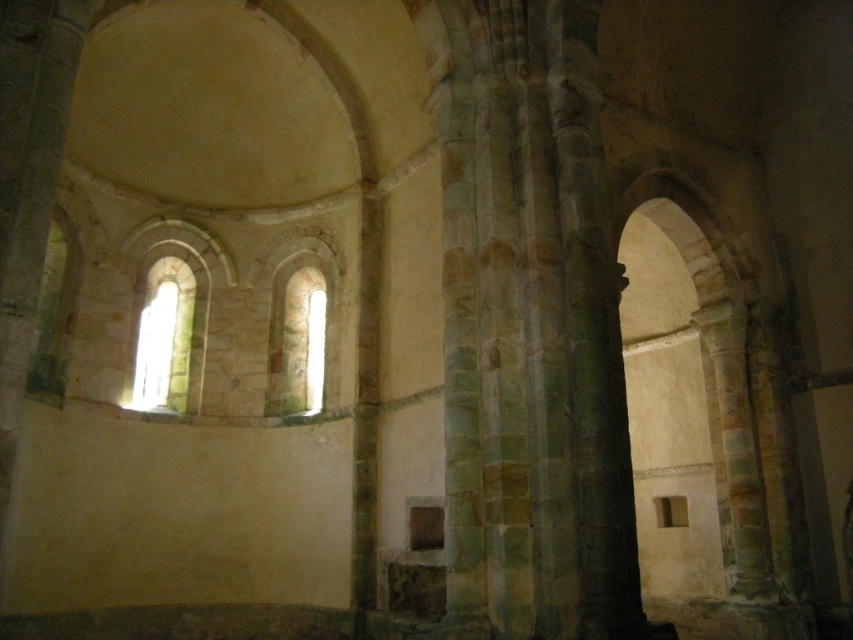
You are an architect examining the historical stone structure. You notice two windows in the left wall. One is a translucent stone window at left and the other is a translucent glass window at center. Which window is positioned higher up on the wall?

The translucent stone window at left is located above the translucent glass window at center, so it is positioned higher up on the wall.